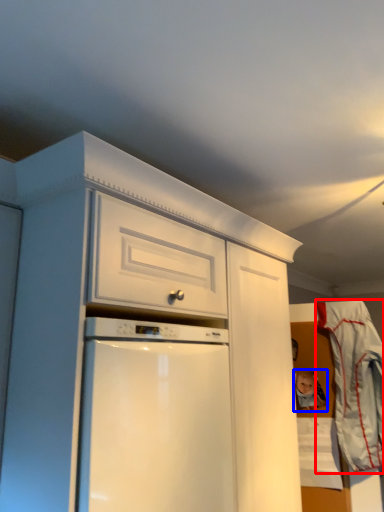
Question: Which object appears farthest to the camera in this image, laundry (highlighted by a red box) or toy (highlighted by a blue box)?

Choices:
 (A) laundry
 (B) toy

Answer: (B)